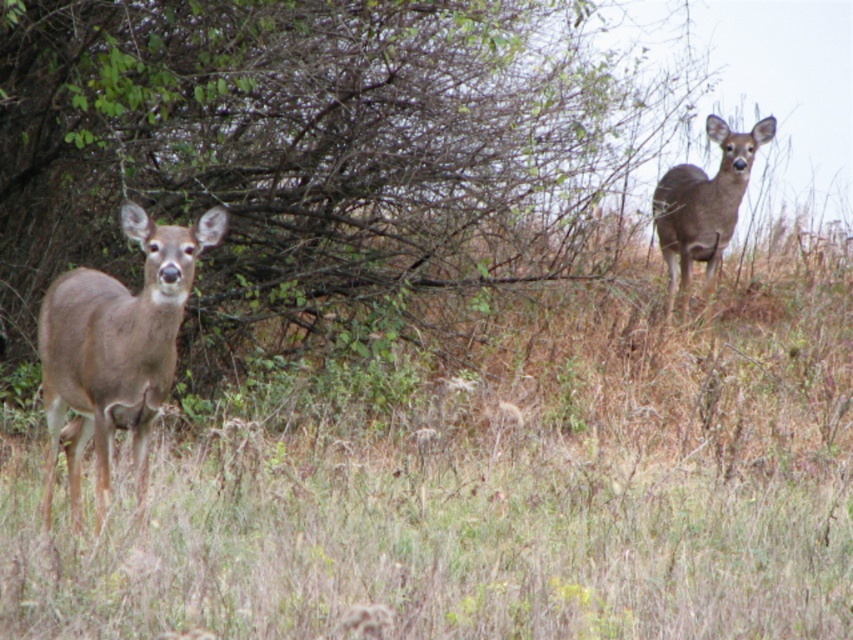
Can you confirm if brown leafy tree at center is bigger than brown matte/deer at upper right?

Yes, brown leafy tree at center is bigger than brown matte/deer at upper right.

The height and width of the screenshot is (640, 853). In order to click on brown leafy tree at center in this screenshot , I will do `click(312, 148)`.

At what (x,y) coordinates should I click in order to perform the action: click on brown leafy tree at center. Please return your answer as a coordinate pair (x, y). Looking at the image, I should click on (312, 148).

Is brown dry grass at center to the left of brown matte deer at left from the viewer's perspective?

In fact, brown dry grass at center is to the right of brown matte deer at left.

Which is behind, point (36, 483) or point (143, 410)?

Point (36, 483)

The image size is (853, 640). I want to click on brown dry grass at center, so click(x=479, y=493).

Does brown dry grass at center appear over brown matte/deer at upper right?

No, brown dry grass at center is not above brown matte/deer at upper right.

Is brown dry grass at center to the left of brown matte/deer at upper right from the viewer's perspective?

Correct, you'll find brown dry grass at center to the left of brown matte/deer at upper right.

What do you see at coordinates (479, 493) in the screenshot?
I see `brown dry grass at center` at bounding box center [479, 493].

Find the location of a particular element. brown dry grass at center is located at coordinates (479, 493).